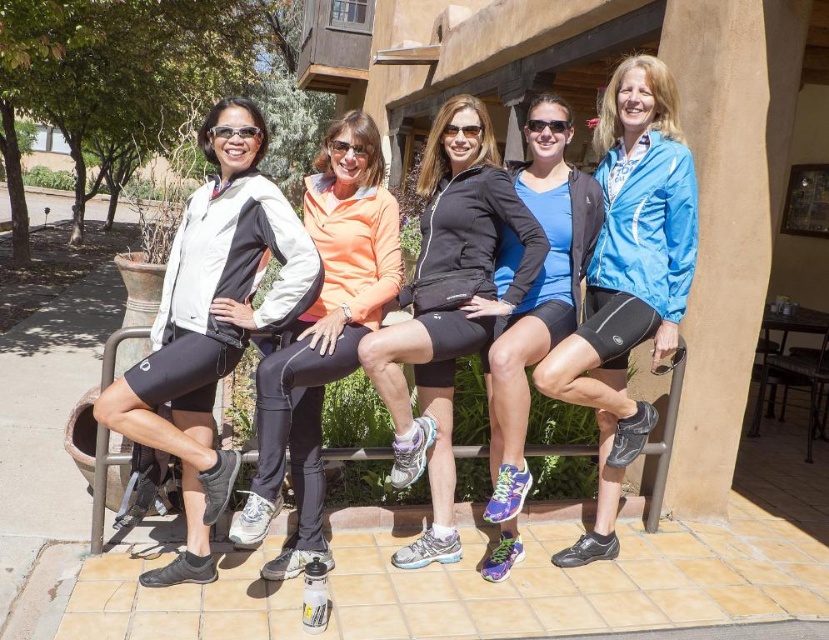
Question: In this image, where is matte black shorts at left located relative to black matte shorts at center?

Choices:
 (A) left
 (B) right

Answer: (A)

Question: Which point is closer to the camera?

Choices:
 (A) black matte shorts at center
 (B) matte black shorts at left

Answer: (B)

Question: Is blue matte jacket at center below matte black leggings at center?

Choices:
 (A) yes
 (B) no

Answer: (B)

Question: Does matte black shorts at left have a greater width compared to blue matte jacket at center?

Choices:
 (A) yes
 (B) no

Answer: (A)

Question: Among these points, which one is nearest to the camera?

Choices:
 (A) (512, 236)
 (B) (604, 230)

Answer: (A)

Question: Which point is closer to the camera?

Choices:
 (A) (663, 278)
 (B) (396, 413)
 (C) (259, 129)
 (D) (503, 568)

Answer: (C)